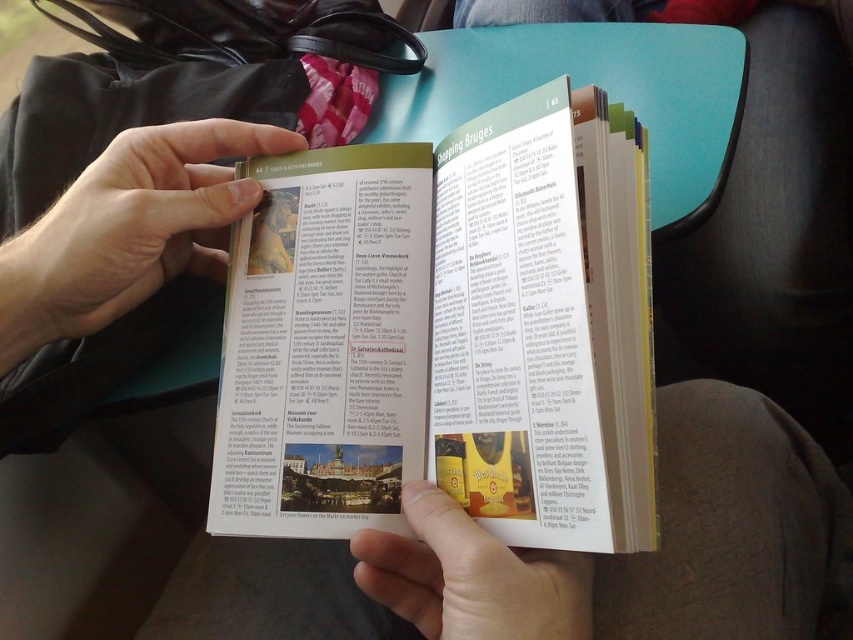
Is paperback book at center bigger than matte yellow paper at lower center?

Yes.

Locate an element on the screen. The width and height of the screenshot is (853, 640). paperback book at center is located at coordinates (445, 333).

The image size is (853, 640). I want to click on paperback book at center, so click(445, 333).

Locate an element on the screen. The image size is (853, 640). paperback book at center is located at coordinates (445, 333).

Is paperback book at center bigger than smooth skin hand at center?

Yes.

From the picture: Between paperback book at center and smooth skin hand at center, which one has more height?

paperback book at center

I want to click on paperback book at center, so click(x=445, y=333).

Can you confirm if smooth skin hand at center is thinner than matte yellow paper at lower center?

No.

Which is more to the right, smooth skin hand at center or matte yellow paper at lower center?

From the viewer's perspective, matte yellow paper at lower center appears more on the right side.

Is point (48, 280) positioned behind point (569, 632)?

Yes, it is behind point (569, 632).

What are the coordinates of `smooth skin hand at center` in the screenshot? It's located at (128, 228).